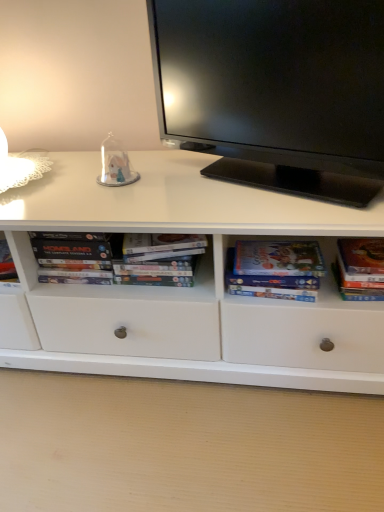
Question: Can you confirm if matte paper book at center right, which is the 1th paperback book from left to right, is shorter than transparent glass dome at center?

Choices:
 (A) yes
 (B) no

Answer: (A)

Question: From a real-world perspective, is matte paper book at center right, the second paperback book from the right, on transparent glass dome at center?

Choices:
 (A) yes
 (B) no

Answer: (B)

Question: Can you confirm if matte paper book at center right, which is the 1th paperback book from left to right, is smaller than transparent glass dome at center?

Choices:
 (A) yes
 (B) no

Answer: (B)

Question: Is transparent glass dome at center inside matte paper book at center right, which is the 1th paperback book from left to right?

Choices:
 (A) no
 (B) yes

Answer: (A)

Question: Is matte paper book at center right, the second paperback book from the right, behind transparent glass dome at center?

Choices:
 (A) no
 (B) yes

Answer: (A)

Question: Is point (155, 61) positioned closer to the camera than point (122, 174)?

Choices:
 (A) closer
 (B) farther

Answer: (B)

Question: Considering their positions, is black glossy television at upper center located in front of or behind transparent glass dome at center?

Choices:
 (A) behind
 (B) front

Answer: (B)

Question: In terms of size, does black glossy television at upper center appear bigger or smaller than transparent glass dome at center?

Choices:
 (A) big
 (B) small

Answer: (A)

Question: From the image's perspective, is black glossy television at upper center positioned above or below transparent glass dome at center?

Choices:
 (A) below
 (B) above

Answer: (B)

Question: Is transparent glass dome at center wider or thinner than black glossy television at upper center?

Choices:
 (A) thin
 (B) wide

Answer: (A)

Question: Would you say transparent glass dome at center is to the left or to the right of black glossy television at upper center in the picture?

Choices:
 (A) right
 (B) left

Answer: (B)

Question: From their relative heights in the image, would you say transparent glass dome at center is taller or shorter than black glossy television at upper center?

Choices:
 (A) tall
 (B) short

Answer: (B)

Question: Is point (105, 154) closer or farther from the camera than point (299, 32)?

Choices:
 (A) closer
 (B) farther

Answer: (B)

Question: Is black glossy television at upper center wider or thinner than white cardboard books at center?

Choices:
 (A) thin
 (B) wide

Answer: (B)

Question: Considering the relative positions of black glossy television at upper center and white cardboard books at center in the image provided, is black glossy television at upper center to the left or to the right of white cardboard books at center?

Choices:
 (A) left
 (B) right

Answer: (B)